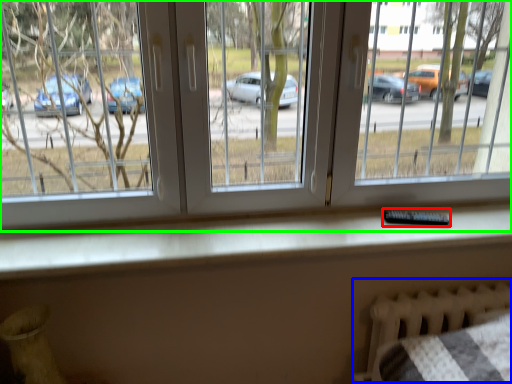
Question: Which object is the closest to the remote (highlighted by a red box)? Choose among these: bed frame (highlighted by a blue box) or window (highlighted by a green box).

Choices:
 (A) bed frame
 (B) window

Answer: (A)